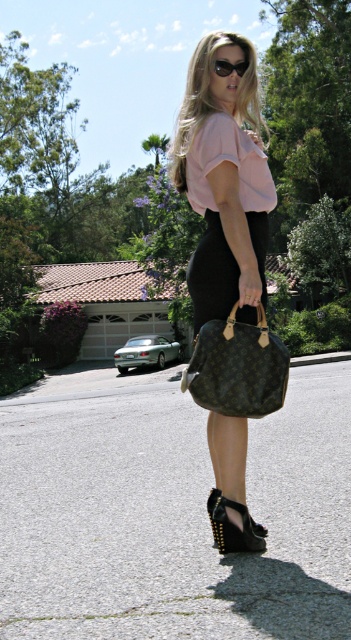
Based on the photo, you are a fashion photographer and want to capture the model wearing the matte black dress at center and holding the monogram canvas handbag at center. To ensure the dress is visible in the photo, where should you position the handbag relative to the dress?

The matte black dress at center is above the monogram canvas handbag at center, so positioning the handbag below the dress will keep them visually separated and ensure the dress remains visible.

You are a fashion designer who wants to place a new accessory on the person in the image. The accessory must be placed exactly at the point marked by the coordinates point (223, 180). What is the name of the clothing item located at this point?

The point (223, 180) marks the location of the matte black dress at center.

You are standing in a suburban driveway and want to take a photo of the matte black dress at center from where you are. Do you think you can capture the entire dress in the frame without moving closer?

The matte black dress at center is 3.12 meters away from the viewer. Depending on the camera lens and zoom capabilities, it might be possible to capture the entire dress without moving closer. However, if the camera has a standard lens, you may need to adjust the zoom or step forward slightly to ensure the dress fills the frame appropriately.